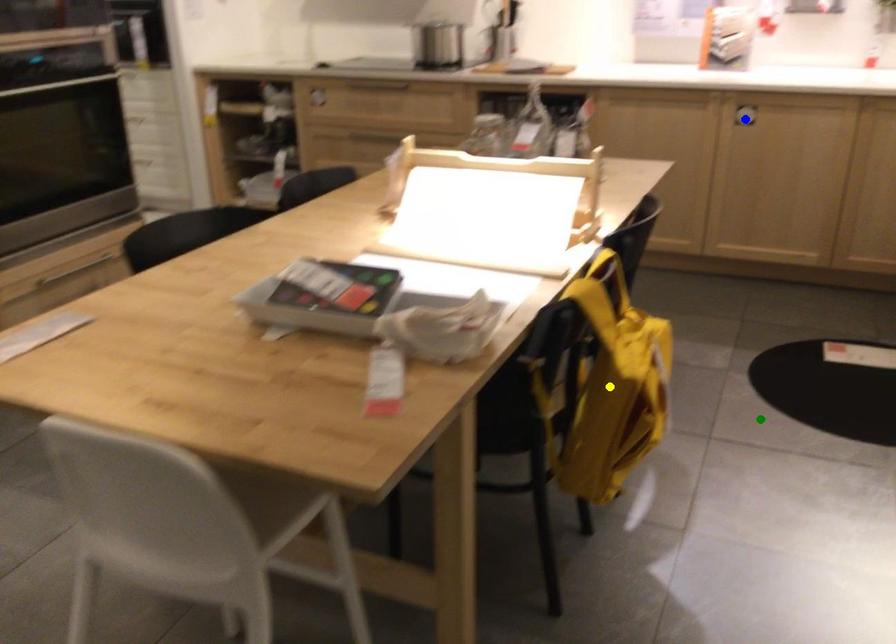
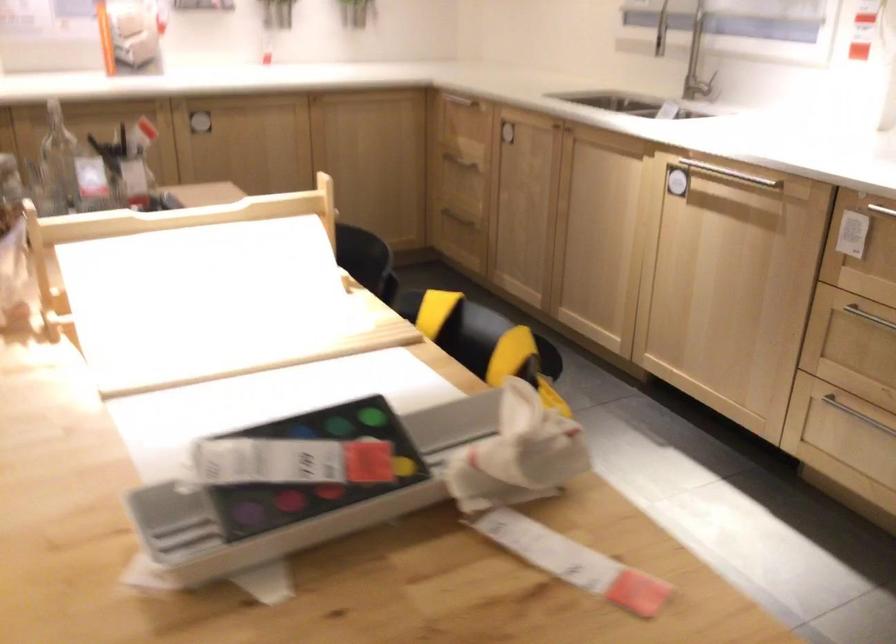
I am providing you with two images of the same scene from different viewpoints. Three points are marked in image1. Which point corresponds to a part or object that is occluded in image2?In image1, three points are marked. Which of them correspond to a part or object that is occluded in image2?Among the three points shown in image1, which one corresponds to a part or object that is no longer visible due to occlusion in image2?

Invisible in image2: blue point, green point, yellow point.